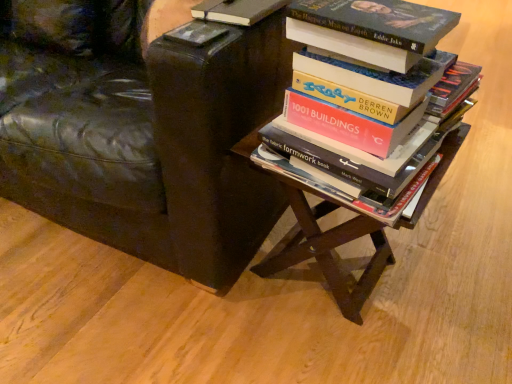
Where is `vacant point above hardcover book at center, the first book from the bottom (from a real-world perspective)`? vacant point above hardcover book at center, the first book from the bottom (from a real-world perspective) is located at coordinates (375, 15).